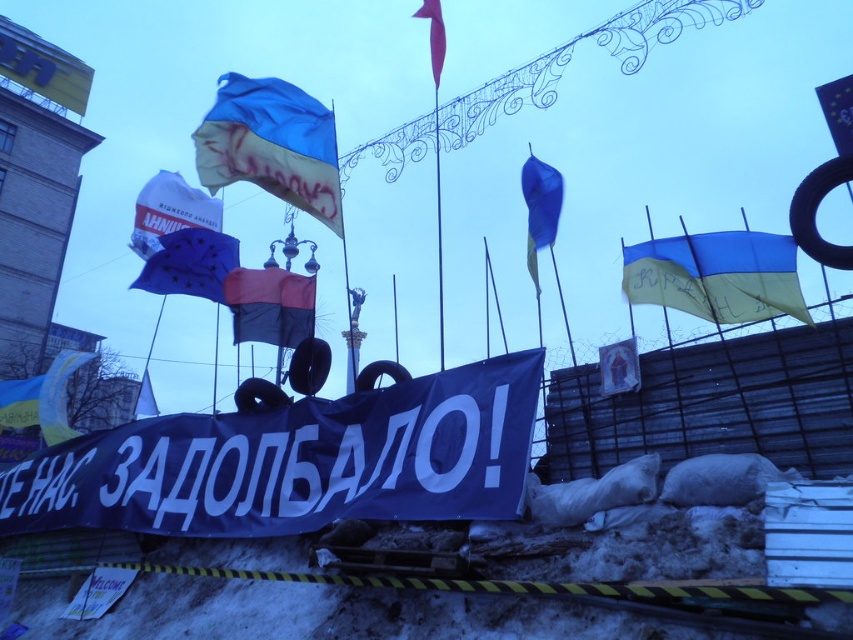
You are a photographer trying to capture the Ukrainian flag in the image. The Ukrainian flag is blue and yellow. There is a point marked at coordinates (271, 145) which points to a blue fabric flag at upper center. Is the Ukrainian flag at the same location as the marked point?

The point (271, 145) indicates a blue fabric flag at upper center, but the Ukrainian flag has both blue and yellow colors. Since the marked point points to a blue fabric flag, it might not be the Ukrainian flag which requires both colors to be present.